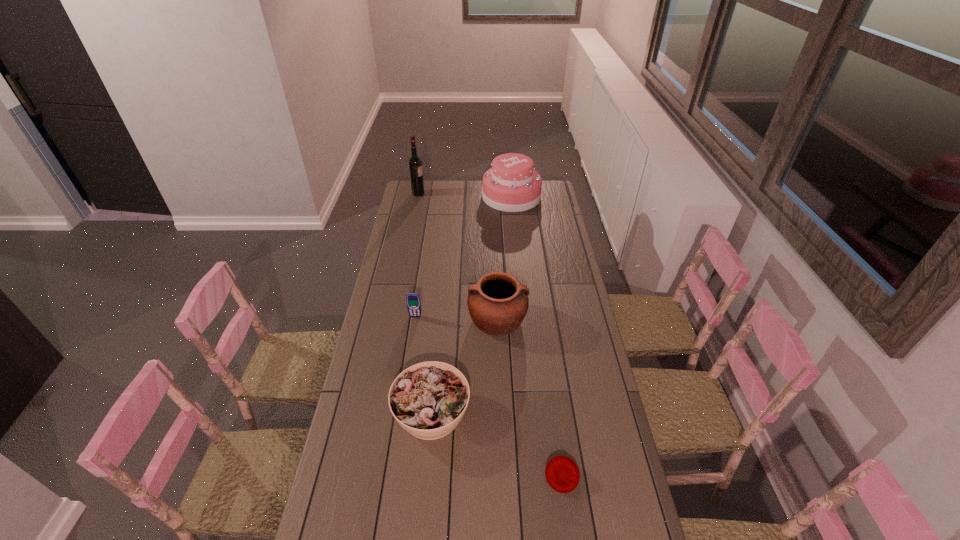
This screenshot has height=540, width=960. In order to click on free space that satisfies the following two spatial constraints: 1. on the front-facing side of the salad; 2. on the left side of the cellular telephone in this screenshot , I will do `click(400, 413)`.